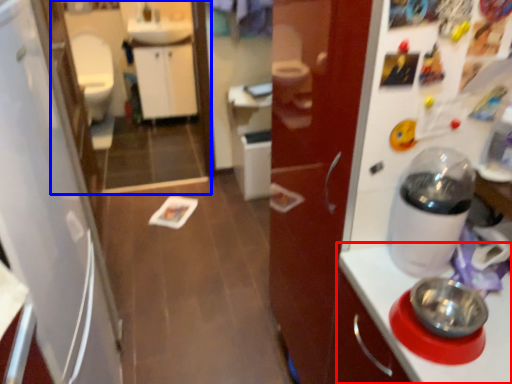
Question: Which object is closer to the camera taking this photo, countertop (highlighted by a red box) or mirror (highlighted by a blue box)?

Choices:
 (A) countertop
 (B) mirror

Answer: (A)